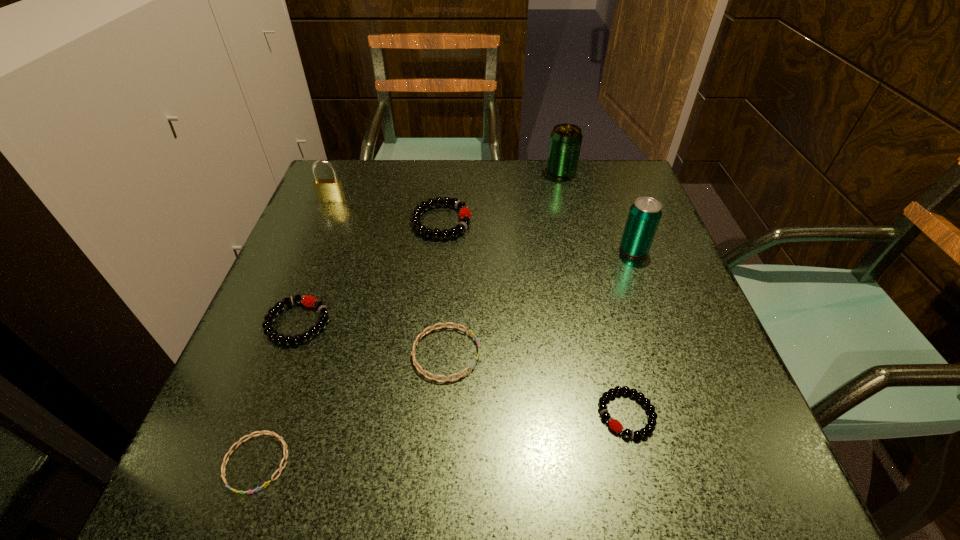
In order to click on the right blue bracelet in this screenshot , I will do pyautogui.click(x=416, y=364).

Where is `the farther blue bracelet`? The image size is (960, 540). the farther blue bracelet is located at coordinates (416, 364).

Identify the location of the rightmost bracelet. (614, 424).

This screenshot has width=960, height=540. Find the location of `the smallest black bracelet`. the smallest black bracelet is located at coordinates (614, 424).

Find the location of a particular element. the smaller blue bracelet is located at coordinates (249, 436).

At what (x,y) coordinates should I click in order to perform the action: click on the nearer blue bracelet. Please return your answer as a coordinate pair (x, y). Looking at the image, I should click on (249, 436).

Locate an element on the screen. The width and height of the screenshot is (960, 540). vacant position located on the left of the farthest object is located at coordinates (461, 172).

What are the coordinates of `vacant area situated 0.180m on the back of the nearer beer can` in the screenshot? It's located at (613, 194).

Identify the location of vacant space situated 0.370m on the front-facing side of the seventh nearest object. (284, 318).

At what (x,y) coordinates should I click in order to perform the action: click on vacant region located on the front of the second black bracelet from left to right. Please return your answer as a coordinate pair (x, y). This screenshot has height=540, width=960. Looking at the image, I should click on (429, 344).